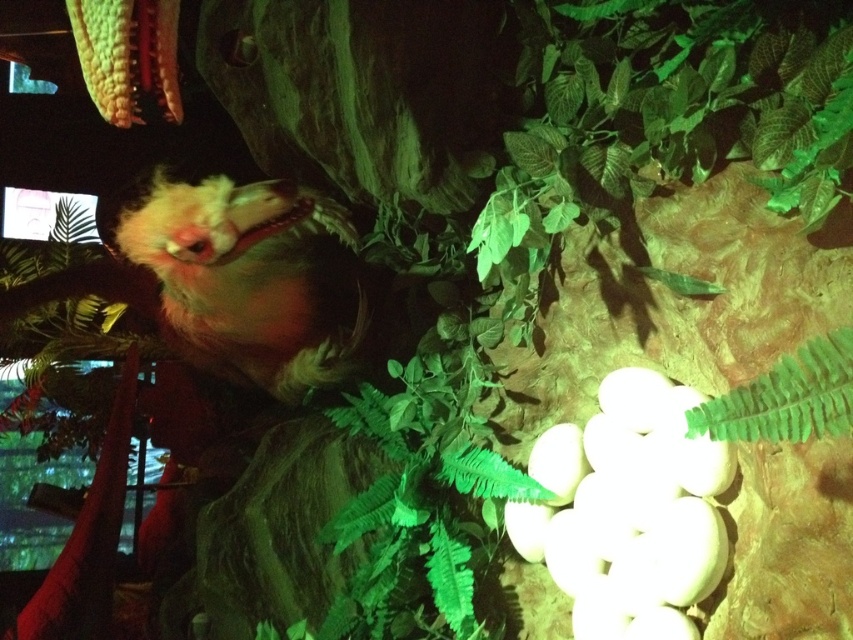
Question: Does fluffy yellow bird at upper left have a smaller size compared to green leafy fern at lower right?

Choices:
 (A) no
 (B) yes

Answer: (A)

Question: Does fluffy yellow bird at upper left appear on the right side of green leafy fern at lower right?

Choices:
 (A) no
 (B) yes

Answer: (A)

Question: Does fluffy yellow bird at upper left appear under green leafy fern at lower right?

Choices:
 (A) yes
 (B) no

Answer: (B)

Question: Which object is farther from the camera taking this photo?

Choices:
 (A) green leafy fern at lower right
 (B) fluffy yellow bird at upper left

Answer: (B)

Question: Among these objects, which one is farthest from the camera?

Choices:
 (A) green leafy fern at lower right
 (B) fluffy yellow bird at upper left

Answer: (B)